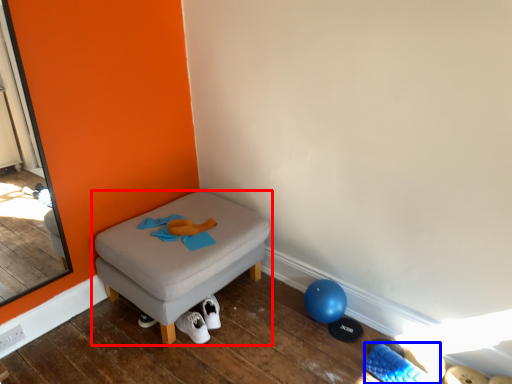
Question: Which of the following is the farthest to the observer, furniture (highlighted by a red box) or footwear (highlighted by a blue box)?

Choices:
 (A) furniture
 (B) footwear

Answer: (A)